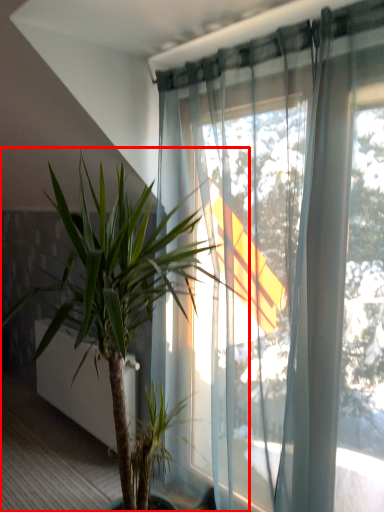
Question: Observing the image, what is the correct spatial positioning of houseplant (annotated by the red box) in reference to screen door?

Choices:
 (A) right
 (B) left

Answer: (A)